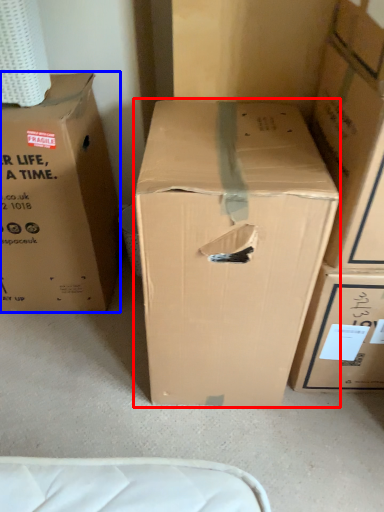
Question: Which point is further to the camera, box (highlighted by a red box) or box (highlighted by a blue box)?

Choices:
 (A) box
 (B) box

Answer: (B)